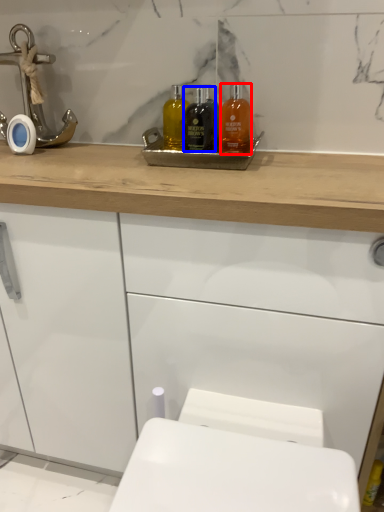
Question: Which object appears closest to the camera in this image, mouthwash (highlighted by a red box) or mouthwash (highlighted by a blue box)?

Choices:
 (A) mouthwash
 (B) mouthwash

Answer: (A)